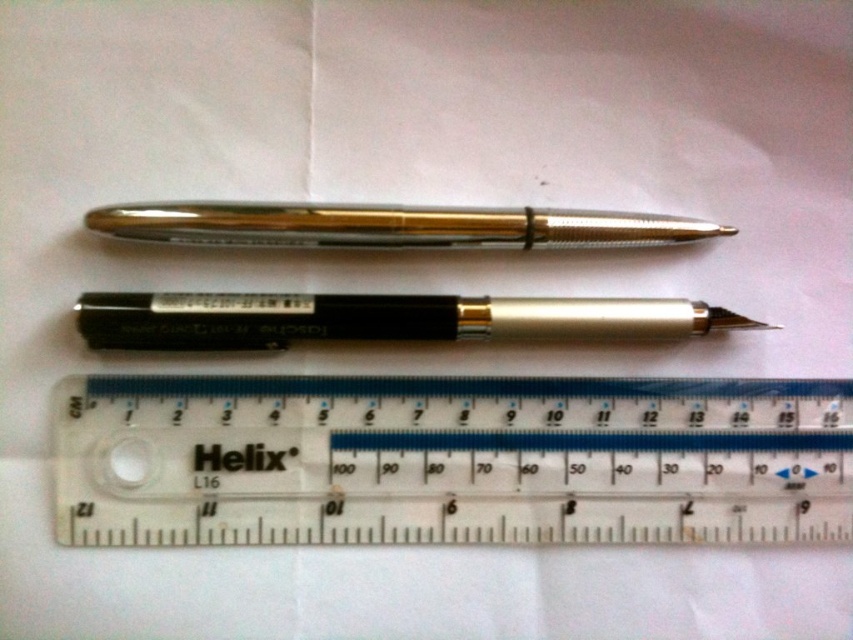
Consider the image. You are an engineer designing a layout for a desk organizer. You need to place two pens horizontally above a transparent ruler labeled Helix. The ruler is at point (444, 465). Where should you position the pens relative to the ruler?

The two pens should be placed horizontally above the transparent plastic ruler at center located at point (444, 465).

You are trying to determine which object is taller between the transparent plastic ruler at center and the gold metallic pen at center. Based on the scene described, which one is taller?

The transparent plastic ruler at center is taller than the gold metallic pen at center.

You have a small box that can only fit items wider than 5 centimeters. You need to place either the transparent plastic ruler at center or the gold metallic pen at center inside. Based on their widths, which item should you choose?

The transparent plastic ruler at center has a larger width than the gold metallic pen at center, so you should choose the transparent plastic ruler at center to place inside the box since it meets the width requirement.